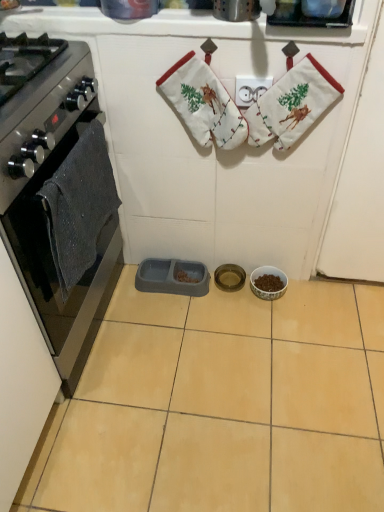
Find the location of a particular element. Image resolution: width=384 pixels, height=512 pixels. vacant space situated on the left part of porcelain bowl at center, the third appliance in the left-to-right sequence is located at coordinates (224, 305).